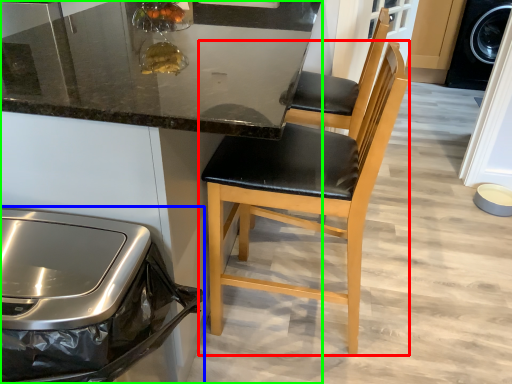
Question: Considering the real-world distances, which object is closest to chair (highlighted by a red box)? home appliance (highlighted by a blue box) or cabinetry (highlighted by a green box).

Choices:
 (A) home appliance
 (B) cabinetry

Answer: (B)